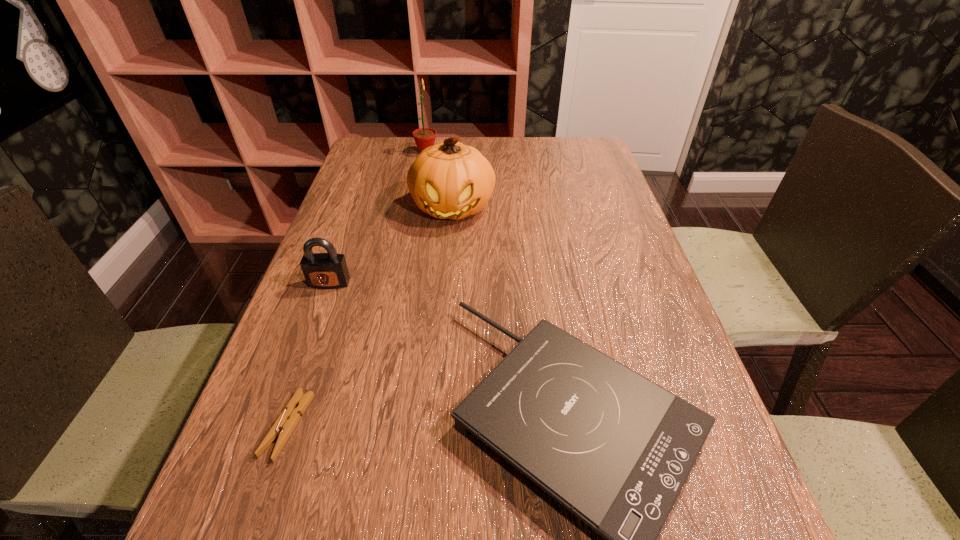
Locate an element on the screen. This screenshot has height=540, width=960. padlock that is at the left edge is located at coordinates (329, 270).

What are the coordinates of `clothespin that is at the left edge` in the screenshot? It's located at (287, 421).

Image resolution: width=960 pixels, height=540 pixels. I want to click on vacant space at the left edge, so click(357, 308).

At what (x,y) coordinates should I click in order to perform the action: click on blank space at the right edge of the desktop. Please return your answer as a coordinate pair (x, y). This screenshot has height=540, width=960. Looking at the image, I should click on (636, 335).

The width and height of the screenshot is (960, 540). In the image, there is a desktop. In order to click on vacant space at the far right corner in this screenshot , I will do pyautogui.click(x=555, y=141).

Where is `vacant region between the pumpkin and the shortest object`? vacant region between the pumpkin and the shortest object is located at coordinates (371, 316).

This screenshot has width=960, height=540. Find the location of `vacant space that's between the shortest object and the third tallest object`. vacant space that's between the shortest object and the third tallest object is located at coordinates (308, 354).

I want to click on vacant region between the fourth nearest object and the clothespin, so pos(371,316).

Identify which object is the third closest to the third nearest object. Please provide its 2D coordinates. Your answer should be formatted as a tuple, i.e. [(x, y)], where the tuple contains the x and y coordinates of a point satisfying the conditions above.

[(287, 421)]

Locate an element on the screen. Image resolution: width=960 pixels, height=540 pixels. object identified as the second closest to the sunflower is located at coordinates (329, 270).